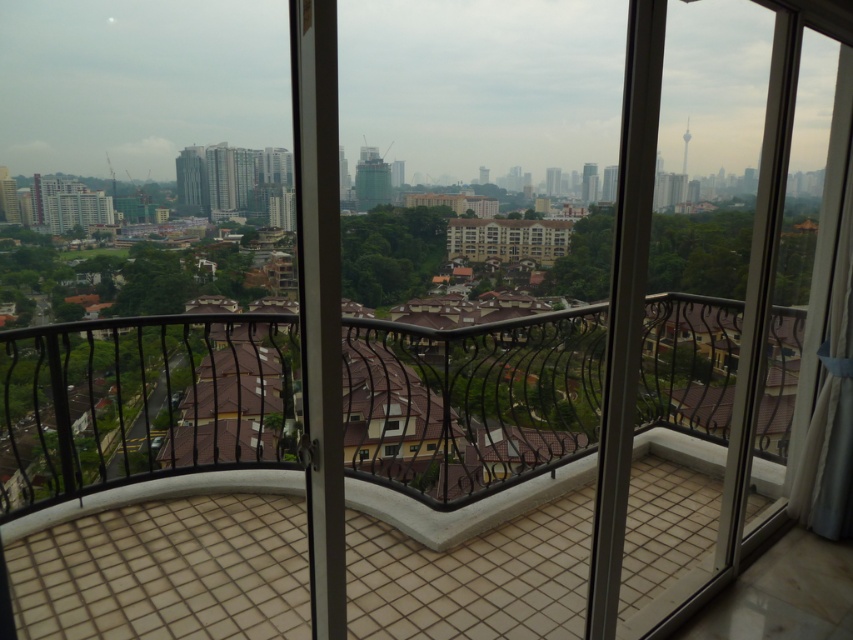
Question: Can you confirm if brown tile balcony at center is bigger than transparent glass window at center?

Choices:
 (A) no
 (B) yes

Answer: (B)

Question: Which point is farther to the camera?

Choices:
 (A) (363, 397)
 (B) (395, 442)

Answer: (A)

Question: Which point is farther to the camera?

Choices:
 (A) (386, 449)
 (B) (138, 394)

Answer: (B)

Question: Is brown tile balcony at center to the right of transparent glass window at center from the viewer's perspective?

Choices:
 (A) yes
 (B) no

Answer: (B)

Question: Does brown tile balcony at center appear on the right side of transparent glass window at center?

Choices:
 (A) yes
 (B) no

Answer: (B)